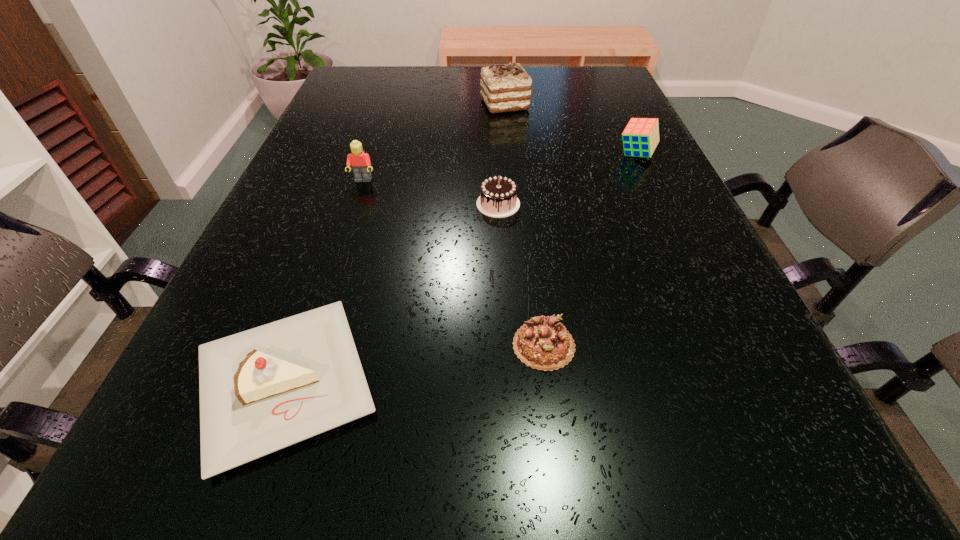
Find the location of a particular element. This screenshot has width=960, height=540. vacant space at the far edge of the desktop is located at coordinates (450, 81).

What are the coordinates of `vacant area at the left edge of the desktop` in the screenshot? It's located at (323, 148).

Where is `vacant space at the right edge`? The image size is (960, 540). vacant space at the right edge is located at coordinates (627, 224).

This screenshot has width=960, height=540. Identify the location of free space at the far left corner of the desktop. (382, 70).

Image resolution: width=960 pixels, height=540 pixels. In the image, there is a desktop. Find the location of `free space at the far right corner`. free space at the far right corner is located at coordinates (585, 67).

Locate an element on the screen. This screenshot has height=540, width=960. free space between the second nearest chocolate cake and the farthest chocolate cake is located at coordinates point(501,154).

Where is `free spot between the second nearest chocolate cake and the Lego`? The height and width of the screenshot is (540, 960). free spot between the second nearest chocolate cake and the Lego is located at coordinates (430, 192).

Find the location of a particular element. This screenshot has height=540, width=960. unoccupied area between the second farthest object and the Lego is located at coordinates tap(499, 167).

You are a GUI agent. You are given a task and a screenshot of the screen. Output one action in this format:
    pyautogui.click(x=<x>, y=<y>)
    Task: Click on the free space between the farthest chocolate cake and the nearest chocolate cake
    The image size is (960, 540).
    Given the screenshot: What is the action you would take?
    pyautogui.click(x=524, y=225)

This screenshot has width=960, height=540. What are the coordinates of `blank region between the third nearest object and the third farthest object` in the screenshot? It's located at (430, 192).